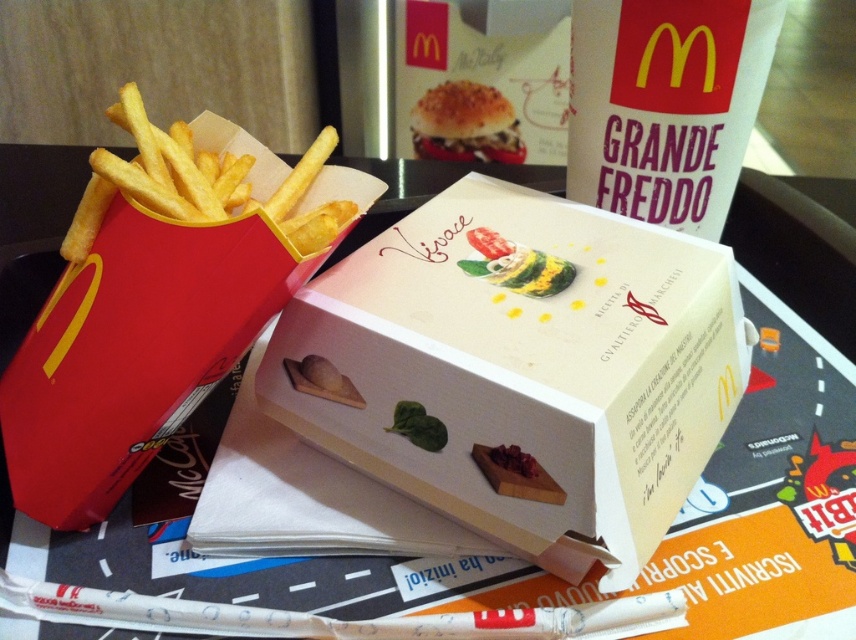
Question: Which point is farther from the camera taking this photo?

Choices:
 (A) (232, 189)
 (B) (9, 448)
 (C) (522, 259)

Answer: (C)

Question: Which point appears closest to the camera in this image?

Choices:
 (A) (508, 131)
 (B) (119, 104)
 (C) (391, 426)
 (D) (138, 380)

Answer: (D)

Question: In this image, where is matte cardboard box at left located relative to breaded crispy bun at upper center?

Choices:
 (A) below
 (B) above

Answer: (A)

Question: Can you confirm if matte cardboard box at left is thinner than golden crispy fries at left?

Choices:
 (A) no
 (B) yes

Answer: (A)

Question: Where is white cardboard box at center located in relation to breaded crispy bun at upper center in the image?

Choices:
 (A) above
 (B) below

Answer: (B)

Question: Which point is farther to the camera?

Choices:
 (A) (82, 227)
 (B) (544, 276)

Answer: (B)